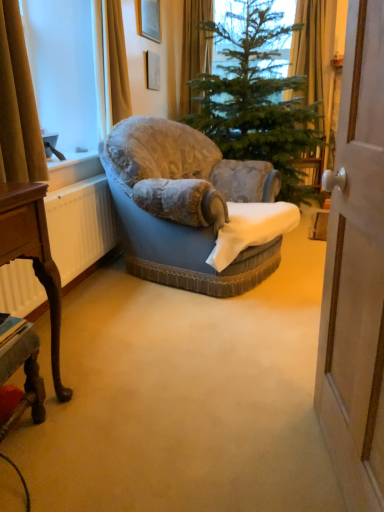
I want to click on vacant region to the right of white matte radiator at left, so click(154, 303).